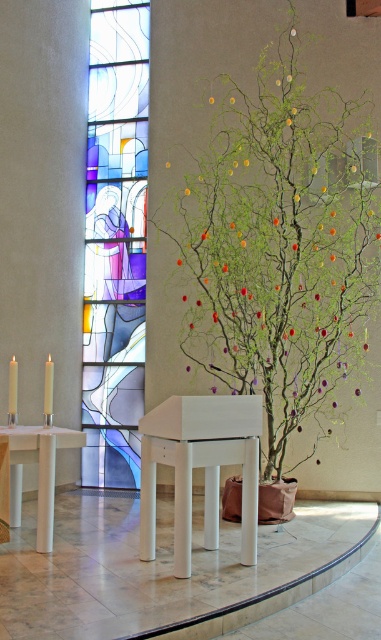
You are standing in front of the altar and want to place a small decoration. You have two points marked in the scene, point 1 at coordinates point (14,488) and point 2 at coordinates point (46,417). Which point is closer to you?

Point 1 at coordinates point (14,488) is closer to you because it is further to the camera than point 2 at coordinates point (46,417).

You are an interior designer planning to hang a large painting. You see the stained glass window at center and the white glossy table at lower left. Which object is a better candidate for hanging the painting above?

The stained glass window at center is much taller than the white glossy table at lower left, so it would be a better candidate for hanging the painting above since it provides a larger vertical space.

You are setting up a small altar and need to place a white wax candle at left on the white glossy table at lower left. Can the candle fit on the table?

The white glossy table at lower left is wider than the white wax candle at left, so yes, the candle can fit on the table.